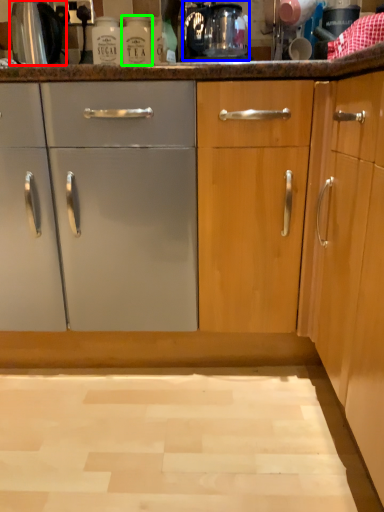
Question: Estimate the real-world distances between objects in this image. Which object is closer to appliance (highlighted by a red box), coffee machine (highlighted by a blue box) or bottle (highlighted by a green box)?

Choices:
 (A) coffee machine
 (B) bottle

Answer: (B)